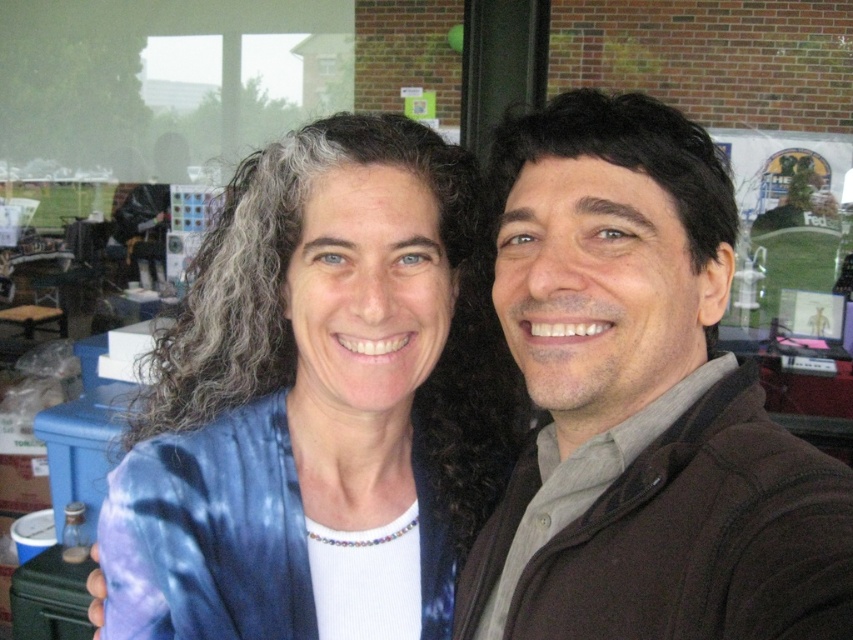
You are standing in front of the two people in the image and notice a point at coordinates (584, 561). If you want to touch this point with your hand, which part of the two people might your hand come into contact with?

The point at coordinates (584, 561) is 69.13 centimeters away from you, so your hand would come into contact with the person on the left wearing the blue tie dye jacket over a white top and a colorful beaded necklace.